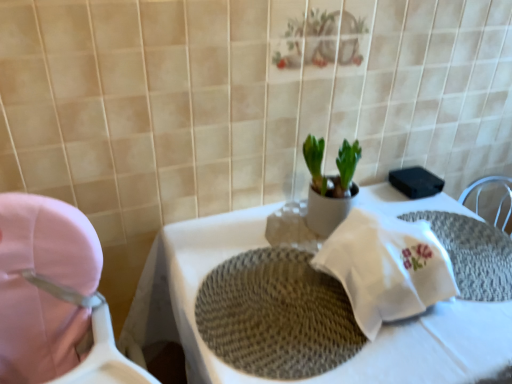
What are the coordinates of `blank space above woven beige placemat at center (from a real-world perspective)` in the screenshot? It's located at (282, 304).